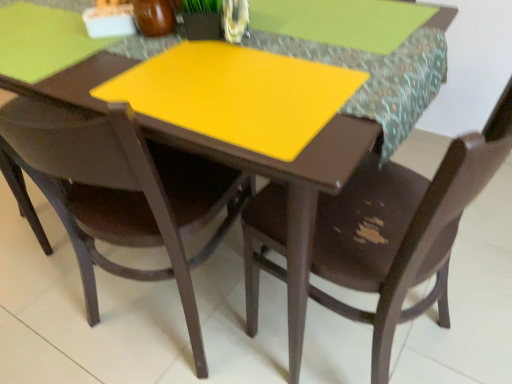
Where is `vacant point to the left of matte brown chair at center, arranged as the first chair when viewed from the left`? vacant point to the left of matte brown chair at center, arranged as the first chair when viewed from the left is located at coordinates (42, 327).